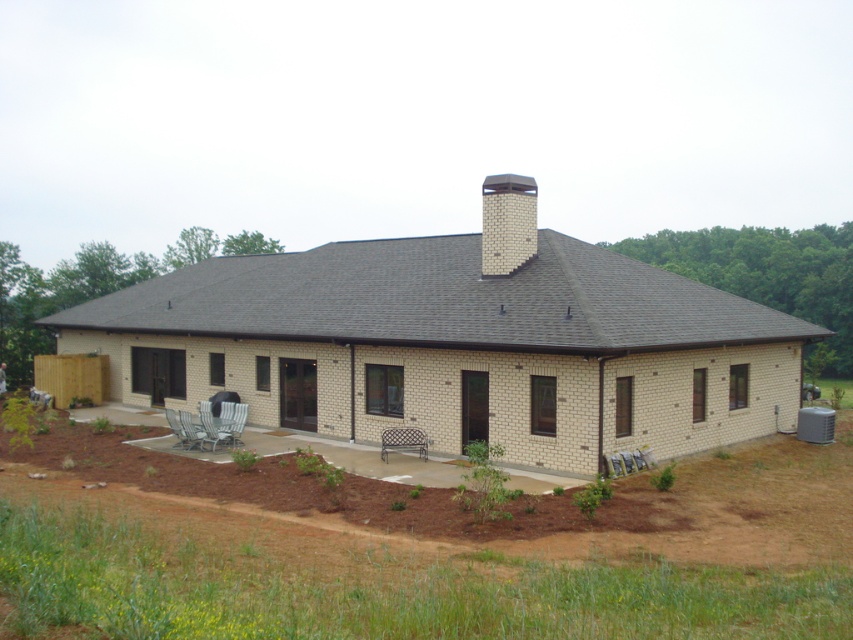
Does white brick chimney at upper center have a lesser height compared to metallic silver chair at lower left?

No.

From the picture: Does white brick chimney at upper center appear on the right side of metallic silver chair at lower left?

Yes, white brick chimney at upper center is to the right of metallic silver chair at lower left.

Does point (514, 216) come farther from viewer compared to point (172, 432)?

Yes, point (514, 216) is behind point (172, 432).

I want to click on white brick chimney at upper center, so click(x=508, y=221).

Is point (418, 448) behind point (183, 445)?

No, (418, 448) is in front of (183, 445).

Who is more distant from viewer, (392, 440) or (177, 436)?

Point (177, 436)

The width and height of the screenshot is (853, 640). Identify the location of metallic silver bench at center. (403, 440).

Image resolution: width=853 pixels, height=640 pixels. I want to click on white brick chimney at upper center, so click(508, 221).

Does point (490, 244) lie in front of point (421, 432)?

No, it is not.

Which is in front, point (531, 221) or point (383, 438)?

Point (383, 438) is in front.

Where is `white brick chimney at upper center`? white brick chimney at upper center is located at coordinates (508, 221).